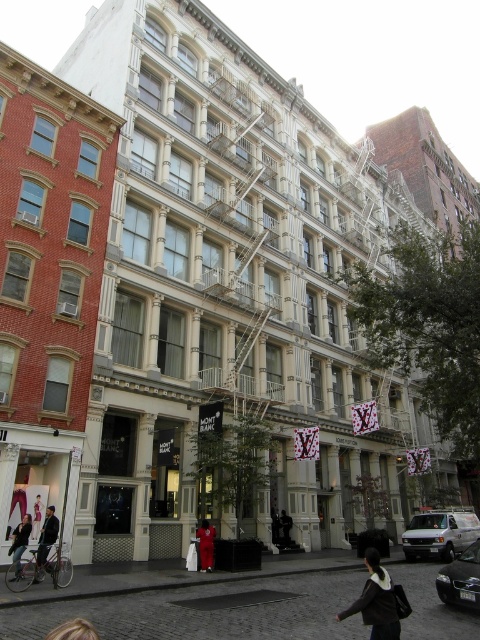
Question: Among these points, which one is farthest from the camera?

Choices:
 (A) (21, 536)
 (B) (36, 502)
 (C) (48, 528)
 (D) (274, 534)

Answer: (D)

Question: From the image, what is the correct spatial relationship of matte black jacket at lower left in relation to dark gray fabric coat at center?

Choices:
 (A) right
 (B) left

Answer: (B)

Question: Which object appears farthest from the camera in this image?

Choices:
 (A) matte black jacket at lower left
 (B) dark gray jacket at lower left
 (C) dark gray fabric coat at center

Answer: (C)

Question: Does red fabric person at center lie behind matte black jacket at lower left?

Choices:
 (A) no
 (B) yes

Answer: (B)

Question: Which object is farther from the camera taking this photo?

Choices:
 (A) dark gray fabric jacket at center
 (B) dark brown leather jacket at lower right
 (C) red fabric person at center

Answer: (A)

Question: From the image, what is the correct spatial relationship of light brown hair at lower left in relation to matte black jacket at lower left?

Choices:
 (A) below
 (B) above

Answer: (B)